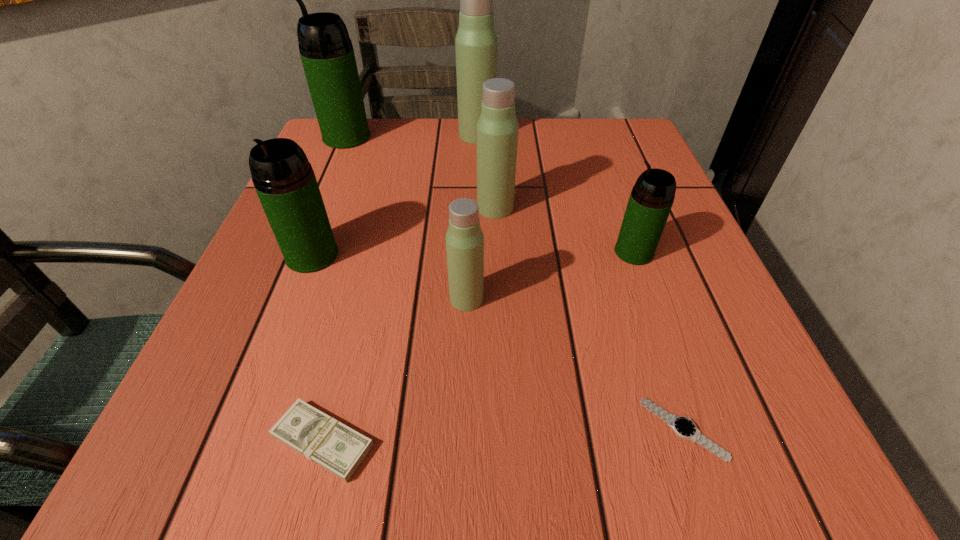
The height and width of the screenshot is (540, 960). Identify the location of the shortest object. (683, 427).

Locate an element on the screen. Image resolution: width=960 pixels, height=540 pixels. vacant region located on the left of the biggest light thermos bottle is located at coordinates (383, 135).

What are the coordinates of `free space located from the spout of the second smallest green thermos bottle` in the screenshot? It's located at (289, 316).

Locate an element on the screen. The height and width of the screenshot is (540, 960). free space located on the right of the second biggest light thermos bottle is located at coordinates (616, 208).

Locate an element on the screen. free location located from the spout of the smallest green thermos bottle is located at coordinates (420, 252).

The image size is (960, 540). Identify the location of free space located from the spout of the smallest green thermos bottle. (425, 252).

I want to click on vacant space located from the spout of the smallest green thermos bottle, so click(586, 252).

Image resolution: width=960 pixels, height=540 pixels. I want to click on vacant space located 0.380m on the back of the nearest light thermos bottle, so click(470, 160).

In order to click on vacant space located 0.100m on the left of the seventh tallest object in this screenshot , I will do `click(189, 441)`.

Image resolution: width=960 pixels, height=540 pixels. Find the location of `blank area located 0.270m on the left of the watch`. blank area located 0.270m on the left of the watch is located at coordinates 428,429.